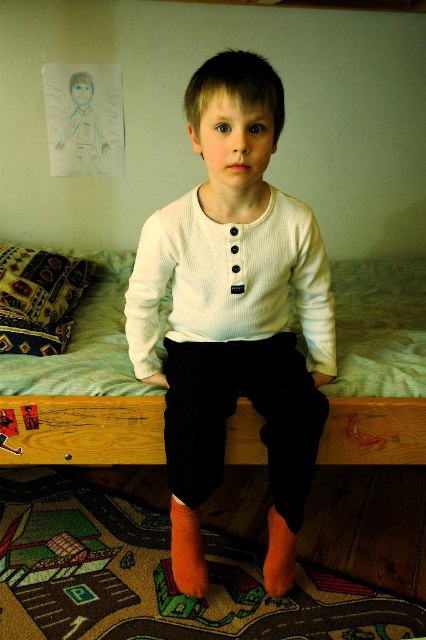
Does white ribbed shirt at center come in front of white ribbed sweater at center?

Yes.

Can you confirm if white ribbed shirt at center is thinner than white ribbed sweater at center?

Yes.

Which is in front, point (190, 134) or point (256, 298)?

Point (190, 134) is more forward.

Where is `white ribbed shirt at center`? The image size is (426, 640). white ribbed shirt at center is located at coordinates (233, 314).

Who is taller, white ribbed shirt at center or wooden bed at center?

white ribbed shirt at center is taller.

This screenshot has width=426, height=640. What are the coordinates of `white ribbed shirt at center` in the screenshot? It's located at (233, 314).

At what (x,y) coordinates should I click in order to perform the action: click on white ribbed shirt at center. Please return your answer as a coordinate pair (x, y). The height and width of the screenshot is (640, 426). Looking at the image, I should click on (233, 314).

Can you confirm if wooden bed at center is bigger than white ribbed sweater at center?

Yes, wooden bed at center is bigger than white ribbed sweater at center.

Does wooden bed at center have a lesser width compared to white ribbed sweater at center?

No, wooden bed at center is not thinner than white ribbed sweater at center.

Between point (89, 321) and point (276, 307), which one is positioned behind?

Point (89, 321)

The height and width of the screenshot is (640, 426). I want to click on wooden bed at center, so click(x=83, y=390).